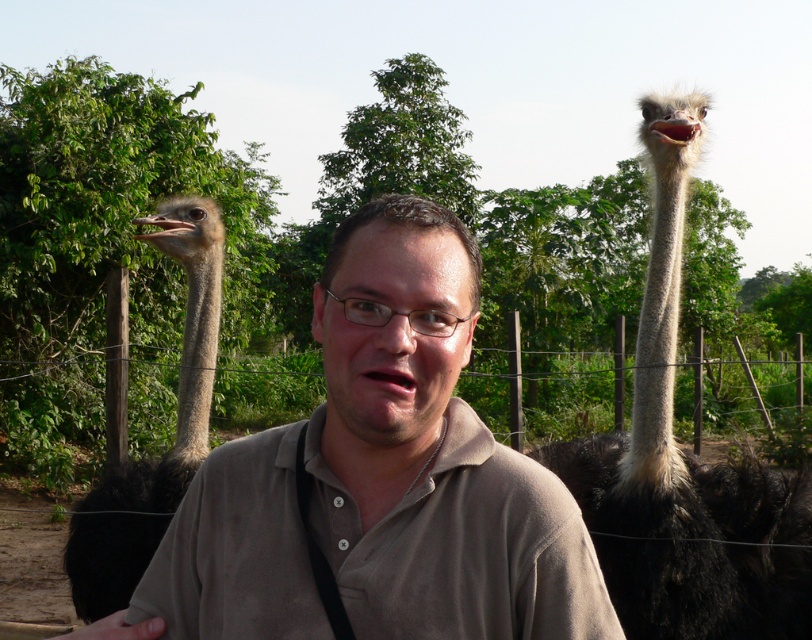
Can you confirm if dark brown feathers at left is positioned above brown matte shirt at center?

Incorrect, dark brown feathers at left is not positioned above brown matte shirt at center.

Does dark brown feathers at left appear on the right side of brown matte shirt at center?

Incorrect, dark brown feathers at left is not on the right side of brown matte shirt at center.

I want to click on dark brown feathers at left, so click(175, 429).

Is point (477, 621) farther from viewer compared to point (715, 627)?

No, (477, 621) is in front of (715, 627).

Which of these two, brown cotton shirt at center or dark brown feathers at right, stands taller?

dark brown feathers at right

Is point (158, 588) closer to viewer compared to point (661, 369)?

Yes, it is in front of point (661, 369).

The image size is (812, 640). In order to click on brown cotton shirt at center in this screenshot , I will do (382, 476).

Is dark brown feathers at right behind dark brown feathers at left?

No, dark brown feathers at right is in front of dark brown feathers at left.

Does dark brown feathers at right appear on the right side of dark brown feathers at left?

Correct, you'll find dark brown feathers at right to the right of dark brown feathers at left.

Which is behind, point (685, 170) or point (108, 492)?

Positioned behind is point (108, 492).

The image size is (812, 640). Identify the location of dark brown feathers at right. (685, 465).